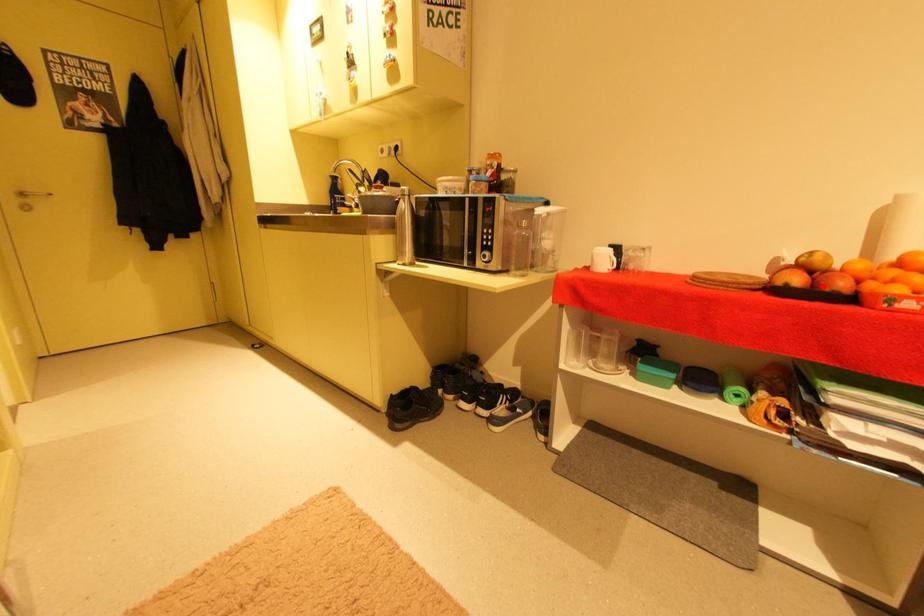
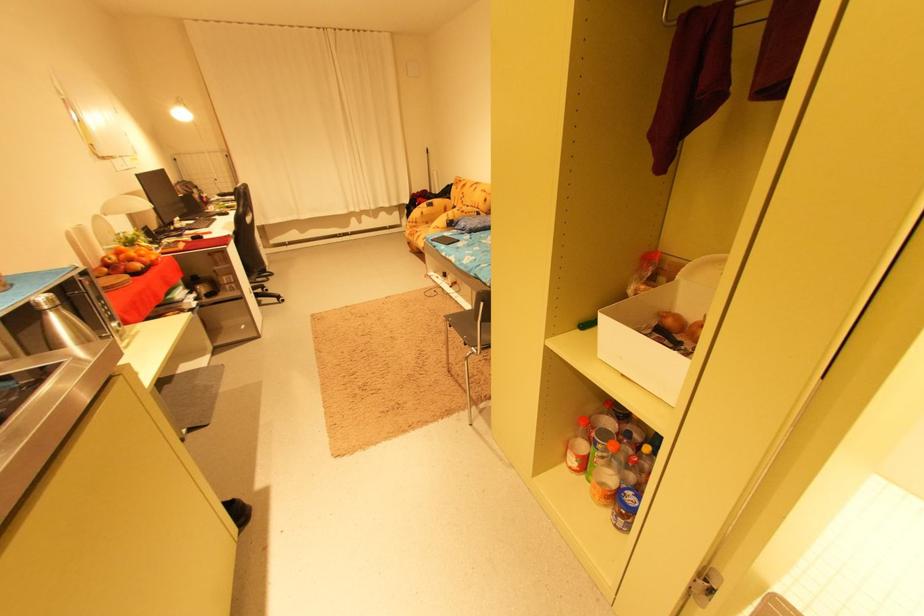
Where in the second image is the point corresponding to the highlighted location from the first image?

(151, 265)